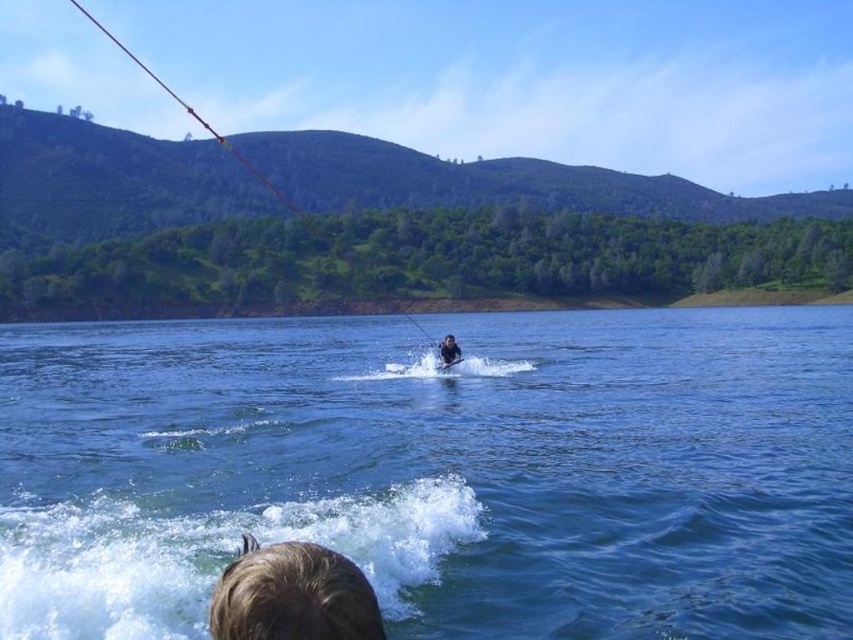
Question: Is brown hair at lower center positioned before smooth skin person at center?

Choices:
 (A) yes
 (B) no

Answer: (A)

Question: Estimate the real-world distances between objects in this image. Which object is closer to the brown hair at lower center?

Choices:
 (A) blue liquid water at center
 (B) smooth skin person at center

Answer: (A)

Question: Can you confirm if brown hair at lower center is positioned below smooth skin person at center?

Choices:
 (A) no
 (B) yes

Answer: (B)

Question: Based on their relative distances, which object is nearer to the blue liquid water at center?

Choices:
 (A) brown hair at lower center
 (B) smooth skin person at center

Answer: (B)

Question: Which point is closer to the camera taking this photo?

Choices:
 (A) (453, 356)
 (B) (500, 621)

Answer: (B)

Question: Does brown hair at lower center appear on the right side of smooth skin person at center?

Choices:
 (A) yes
 (B) no

Answer: (B)